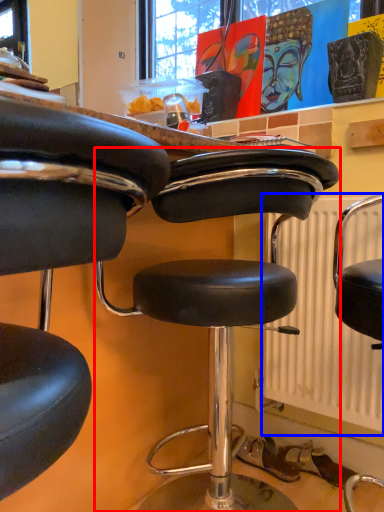
Question: Which object appears closest to the camera in this image, chair (highlighted by a red box) or radiator (highlighted by a blue box)?

Choices:
 (A) chair
 (B) radiator

Answer: (B)